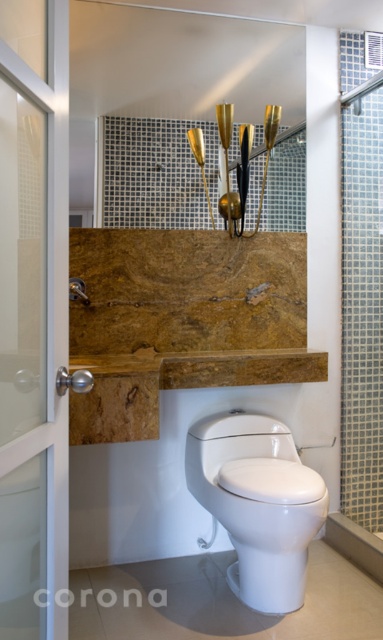
Can you confirm if white glossy toilet at center is positioned above clear glass door at left?

Actually, white glossy toilet at center is below clear glass door at left.

From the picture: Is the position of white glossy toilet at center more distant than that of clear glass door at left?

Yes.

Which is in front, point (220, 481) or point (49, 362)?

Point (49, 362) is more forward.

Locate an element on the screen. white glossy toilet at center is located at coordinates (256, 504).